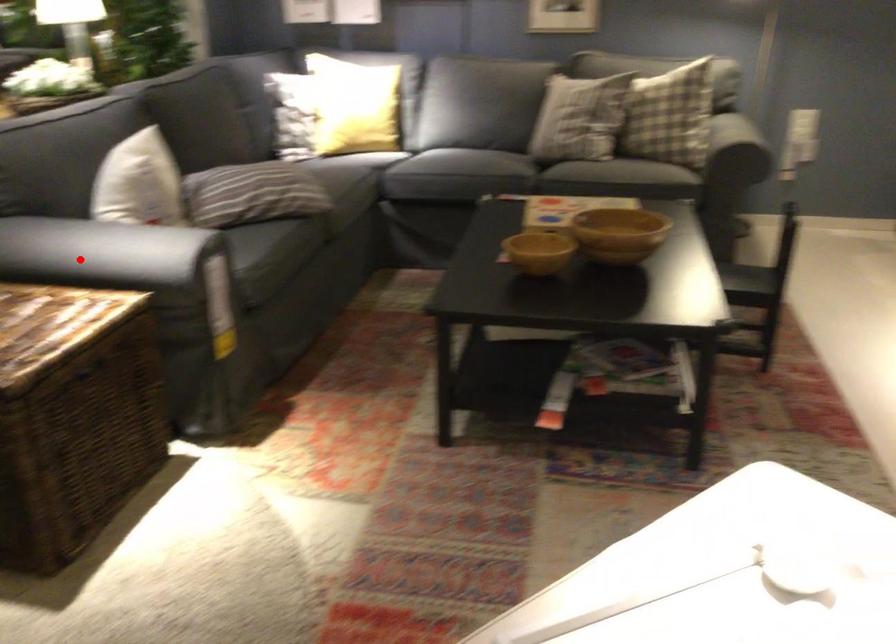
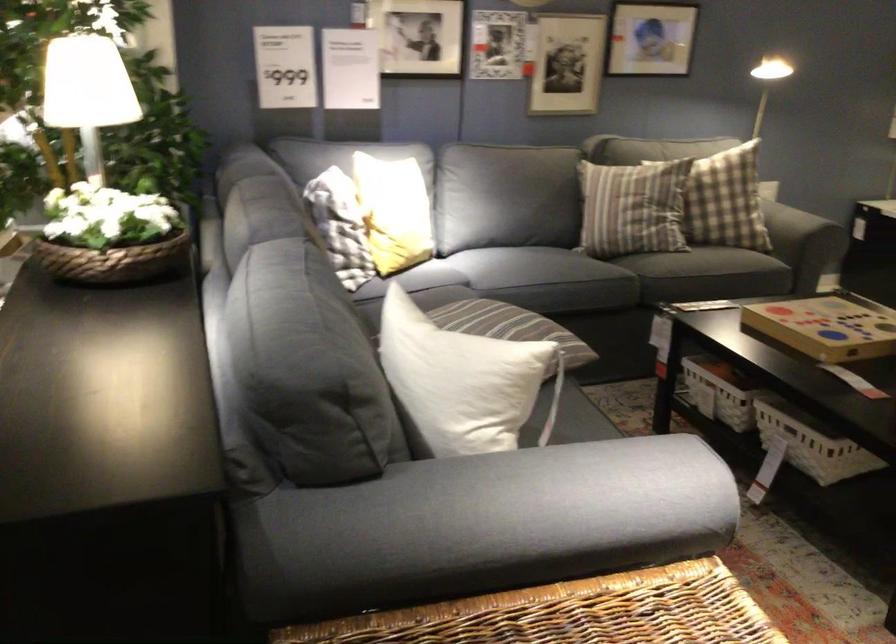
Where in the second image is the point corresponding to the highlighted location from the first image?

(528, 500)